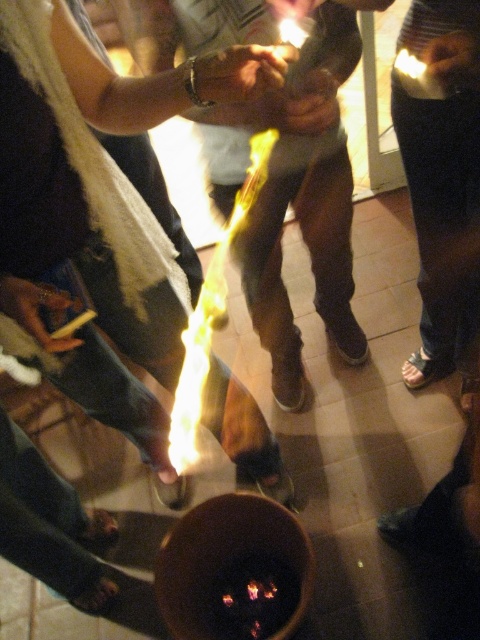
Does fluorescent yellow flame at center appear over matte brown skin at center?

No.

Is fluorescent yellow flame at center to the right of matte brown skin at center from the viewer's perspective?

Incorrect, fluorescent yellow flame at center is not on the right side of matte brown skin at center.

Does point (194, 426) lie in front of point (328, 118)?

No, (194, 426) is behind (328, 118).

Image resolution: width=480 pixels, height=640 pixels. In order to click on fluorescent yellow flame at center in this screenshot , I will do `click(211, 316)`.

Does matte brown skin at center appear under matte black hand at lower left?

Actually, matte brown skin at center is above matte black hand at lower left.

Does matte brown skin at center have a greater height compared to matte black hand at lower left?

Indeed, matte brown skin at center has a greater height compared to matte black hand at lower left.

Between point (319, 76) and point (28, 304), which one is positioned behind?

The point (319, 76) is more distant.

Locate an element on the screen. This screenshot has height=640, width=480. matte brown skin at center is located at coordinates (304, 106).

Who is positioned more to the left, smooth leather bracelet at center or matte black hand at center?

Positioned to the left is smooth leather bracelet at center.

Does smooth leather bracelet at center appear on the left side of matte black hand at center?

Correct, you'll find smooth leather bracelet at center to the left of matte black hand at center.

Who is more forward, (194, 81) or (285, 13)?

Point (194, 81) is more forward.

Image resolution: width=480 pixels, height=640 pixels. What are the coordinates of `smooth leather bracelet at center` in the screenshot? It's located at (238, 74).